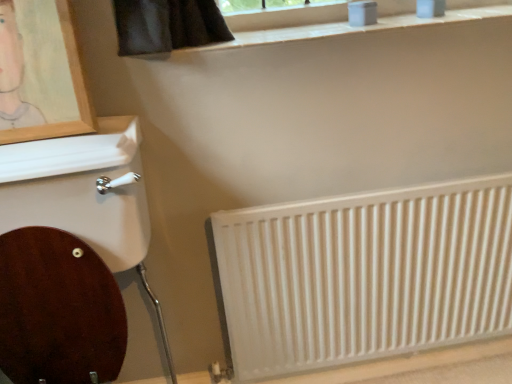
Question: From a real-world perspective, is white textured radiator at lower right over wooden picture frame at upper left?

Choices:
 (A) no
 (B) yes

Answer: (A)

Question: Could you tell me if white textured radiator at lower right is facing wooden picture frame at upper left?

Choices:
 (A) no
 (B) yes

Answer: (A)

Question: Can you confirm if white textured radiator at lower right is taller than wooden picture frame at upper left?

Choices:
 (A) yes
 (B) no

Answer: (A)

Question: Can you confirm if white textured radiator at lower right is positioned to the left of wooden picture frame at upper left?

Choices:
 (A) yes
 (B) no

Answer: (B)

Question: From a real-world perspective, is white textured radiator at lower right under wooden picture frame at upper left?

Choices:
 (A) yes
 (B) no

Answer: (A)

Question: From the image's perspective, would you say white textured radiator at lower right is positioned over wooden picture frame at upper left?

Choices:
 (A) no
 (B) yes

Answer: (A)

Question: Does wooden picture frame at upper left lie behind white textured radiator at lower right?

Choices:
 (A) yes
 (B) no

Answer: (B)

Question: Is wooden picture frame at upper left not inside white textured radiator at lower right?

Choices:
 (A) yes
 (B) no

Answer: (A)

Question: Does wooden picture frame at upper left have a lesser height compared to white textured radiator at lower right?

Choices:
 (A) no
 (B) yes

Answer: (B)

Question: Does wooden picture frame at upper left appear on the left side of white textured radiator at lower right?

Choices:
 (A) no
 (B) yes

Answer: (B)

Question: Does wooden picture frame at upper left have a larger size compared to white textured radiator at lower right?

Choices:
 (A) yes
 (B) no

Answer: (B)

Question: Can you confirm if wooden picture frame at upper left is thinner than white textured radiator at lower right?

Choices:
 (A) yes
 (B) no

Answer: (B)

Question: From the image's perspective, is wooden picture frame at upper left above or below white textured radiator at lower right?

Choices:
 (A) below
 (B) above

Answer: (B)